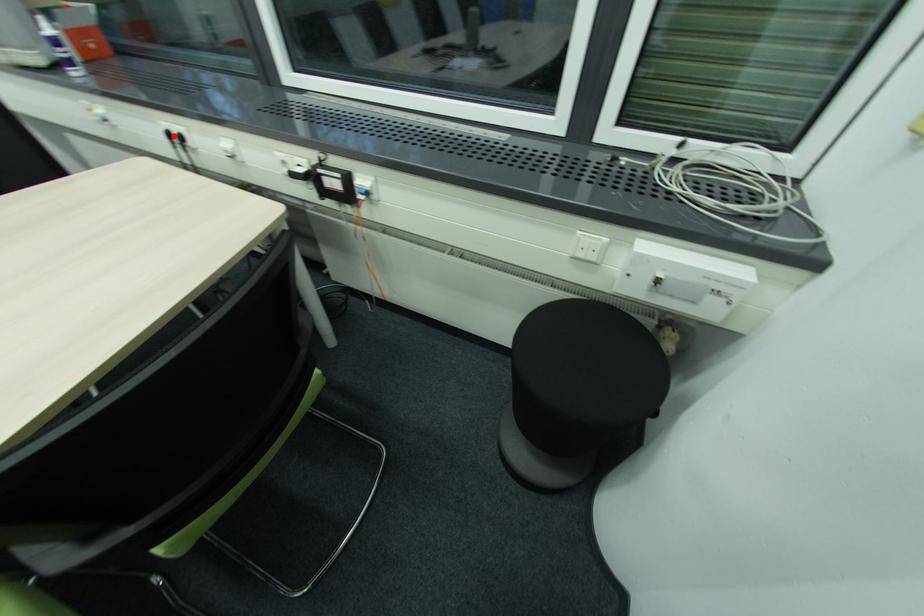
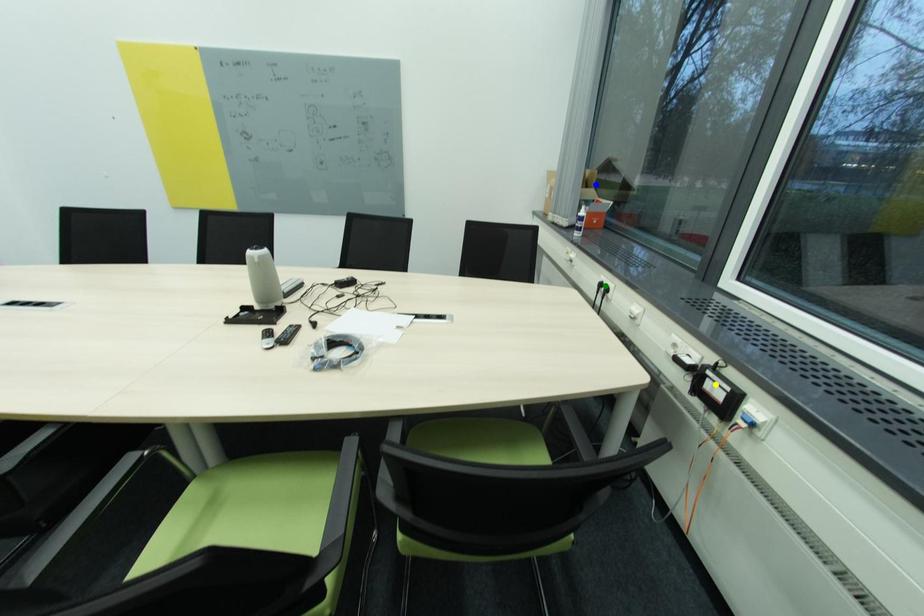
Question: I am providing you with two images of the same scene from different viewpoints. A red point is marked on the first image. You are given multiple points on the second image. Can you choose the point in image 2 that corresponds to the point in image 1?

Choices:
 (A) blue point
 (B) green point
 (C) yellow point

Answer: (B)